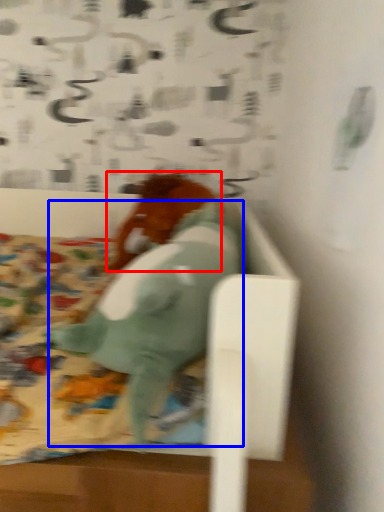
Question: Which of the following is the closest to the observer, animal (highlighted by a red box) or animal (highlighted by a blue box)?

Choices:
 (A) animal
 (B) animal

Answer: (B)